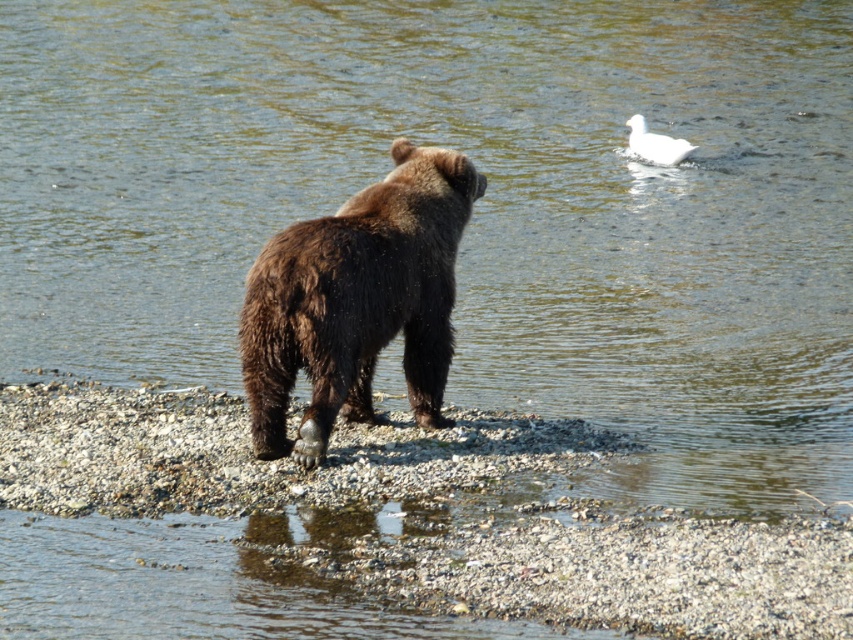
Question: Where is brown furry bear at center located in relation to white matte duck at upper right in the image?

Choices:
 (A) below
 (B) above

Answer: (A)

Question: Among these objects, which one is nearest to the camera?

Choices:
 (A) smooth gravel shore at center
 (B) white matte duck at upper right
 (C) brown furry bear at center

Answer: (A)

Question: In this image, where is brown furry bear at center located relative to white matte duck at upper right?

Choices:
 (A) below
 (B) above

Answer: (A)

Question: Based on their relative distances, which object is nearer to the white matte duck at upper right?

Choices:
 (A) brown furry bear at center
 (B) smooth gravel shore at center

Answer: (A)

Question: Does smooth gravel shore at center appear over white matte duck at upper right?

Choices:
 (A) yes
 (B) no

Answer: (B)

Question: Which of the following is the farthest from the observer?

Choices:
 (A) (415, 436)
 (B) (445, 374)

Answer: (B)